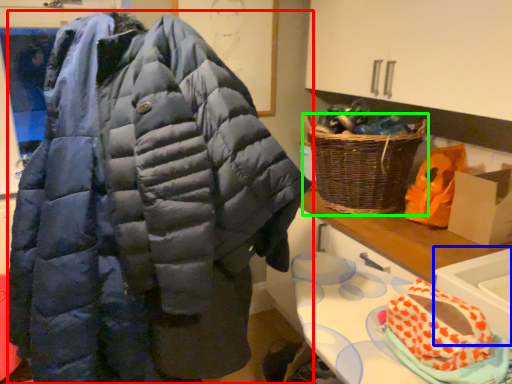
Question: Which object is positioned closest to jacket (highlighted by a red box)? Select from sink (highlighted by a blue box) and picnic basket (highlighted by a green box).

Choices:
 (A) sink
 (B) picnic basket

Answer: (A)